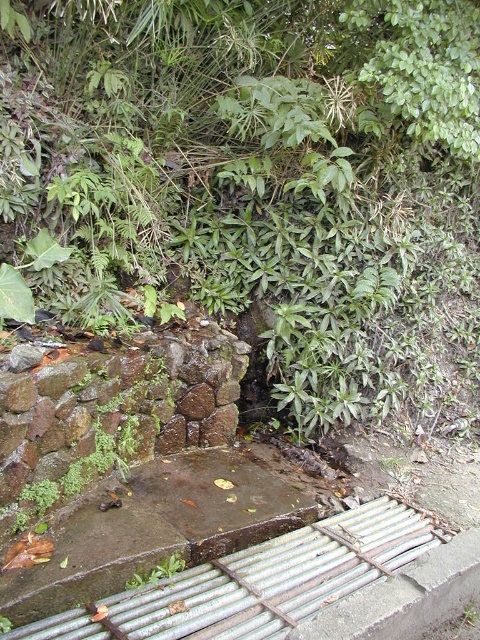
Question: Is green leafy tree at center positioned before green leafy plant at lower left?

Choices:
 (A) yes
 (B) no

Answer: (B)

Question: Is green leafy tree at center wider than green leafy plant at lower left?

Choices:
 (A) yes
 (B) no

Answer: (A)

Question: Which object appears farthest from the camera in this image?

Choices:
 (A) green leafy tree at center
 (B) green leafy plant at lower left

Answer: (A)

Question: Which point appears farthest from the camera in this image?

Choices:
 (A) (336, 346)
 (B) (135, 573)

Answer: (A)

Question: Does green leafy tree at center appear on the left side of green leafy plant at lower left?

Choices:
 (A) no
 (B) yes

Answer: (A)